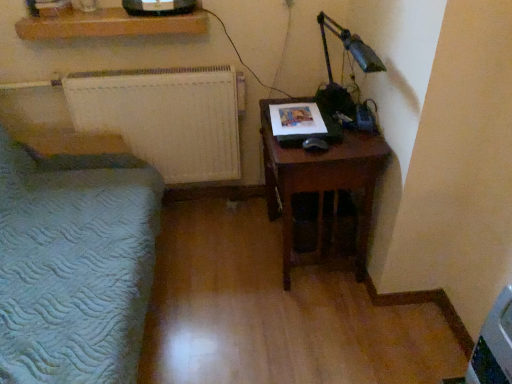
Question: Does white textured radiator at left appear on the right side of metallic green desk lamp at upper right?

Choices:
 (A) no
 (B) yes

Answer: (A)

Question: Can you confirm if white textured radiator at left is shorter than metallic green desk lamp at upper right?

Choices:
 (A) yes
 (B) no

Answer: (B)

Question: Is white textured radiator at left thinner than metallic green desk lamp at upper right?

Choices:
 (A) yes
 (B) no

Answer: (B)

Question: From a real-world perspective, is white textured radiator at left located higher than metallic green desk lamp at upper right?

Choices:
 (A) yes
 (B) no

Answer: (B)

Question: From the image's perspective, would you say white textured radiator at left is shown under metallic green desk lamp at upper right?

Choices:
 (A) no
 (B) yes

Answer: (B)

Question: Can you confirm if white textured radiator at left is taller than metallic green desk lamp at upper right?

Choices:
 (A) yes
 (B) no

Answer: (A)

Question: Is metallic green desk lamp at upper right to the right of brown wooden nightstand at right from the viewer's perspective?

Choices:
 (A) yes
 (B) no

Answer: (A)

Question: Does metallic green desk lamp at upper right lie behind brown wooden nightstand at right?

Choices:
 (A) no
 (B) yes

Answer: (A)

Question: Is brown wooden nightstand at right inside metallic green desk lamp at upper right?

Choices:
 (A) yes
 (B) no

Answer: (B)

Question: Is the surface of metallic green desk lamp at upper right in direct contact with brown wooden nightstand at right?

Choices:
 (A) yes
 (B) no

Answer: (B)

Question: Is metallic green desk lamp at upper right smaller than brown wooden nightstand at right?

Choices:
 (A) no
 (B) yes

Answer: (B)

Question: Is metallic green desk lamp at upper right aimed at brown wooden nightstand at right?

Choices:
 (A) no
 (B) yes

Answer: (A)

Question: Is the position of brown wooden nightstand at right more distant than that of wooden shelf at upper center?

Choices:
 (A) yes
 (B) no

Answer: (B)